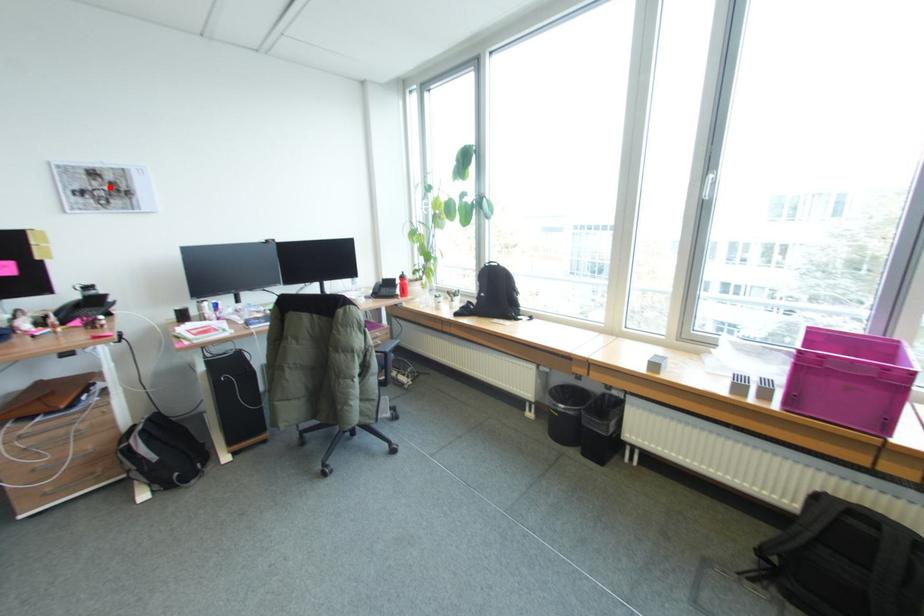
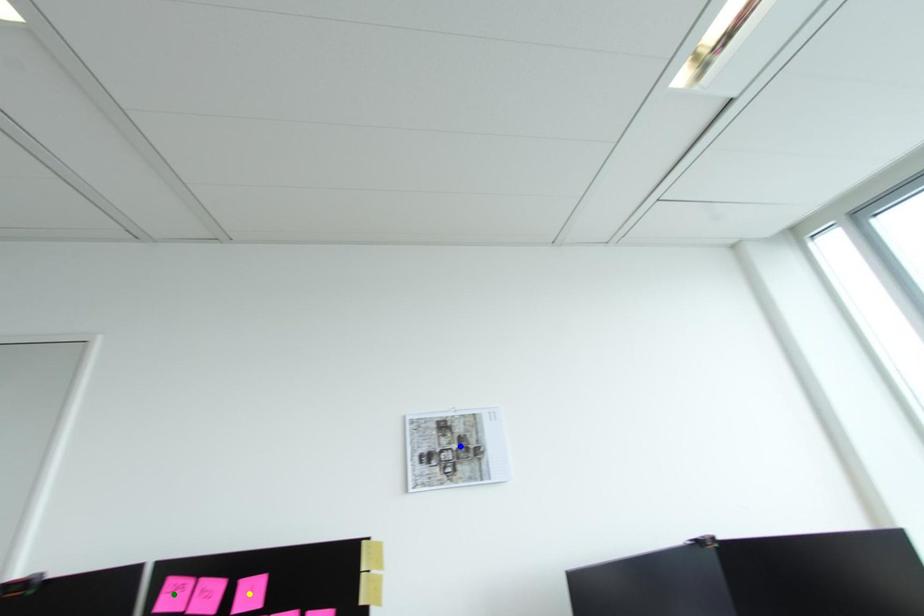
Question: I am providing you with two images of the same scene from different viewpoints. A red point is marked on the first image. You are given multiple points on the second image. Which point in image 2 is actually the same real-world point as the red point in image 1?

Choices:
 (A) yellow point
 (B) blue point
 (C) green point

Answer: (B)